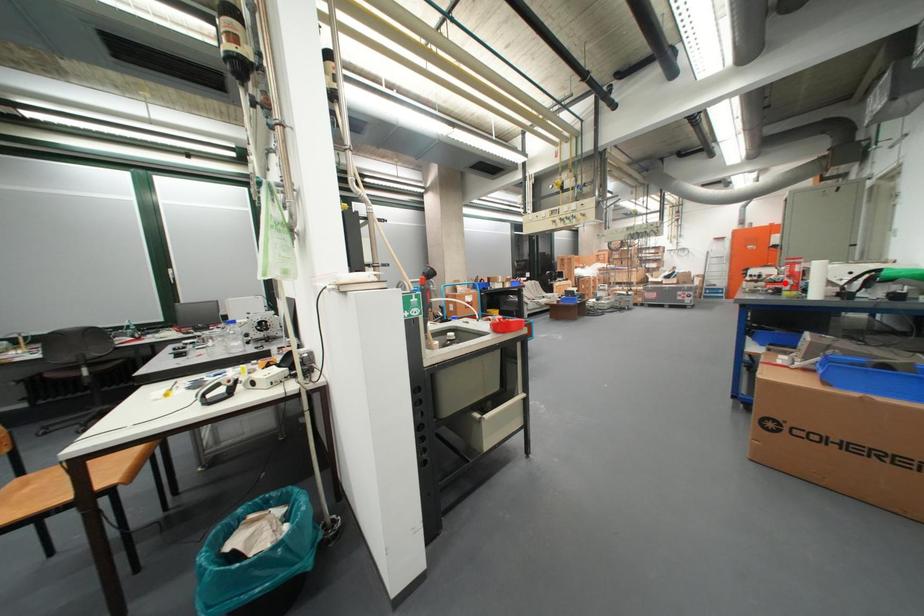
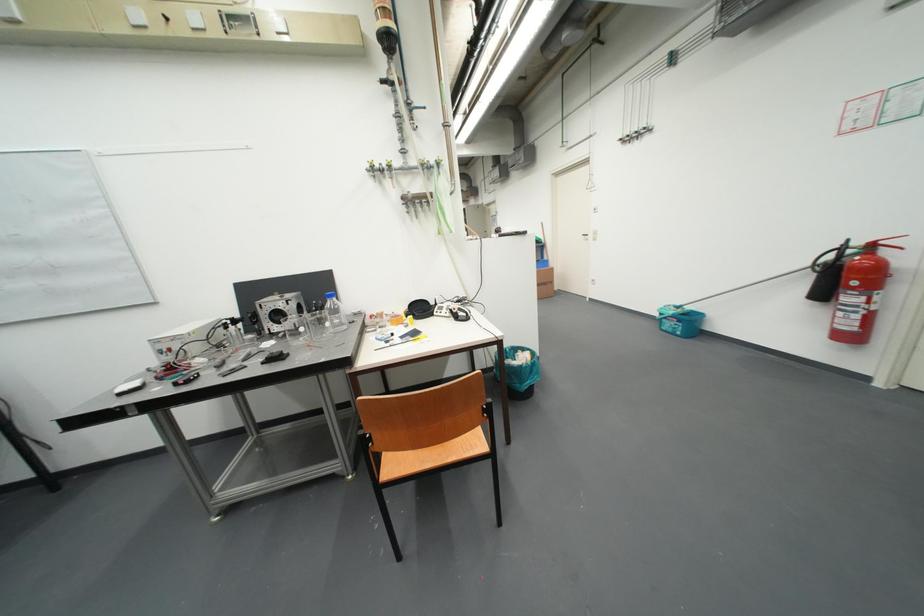
Question: I am providing you with two images of the same scene from different viewpoints. A red point is marked on the first image. Is the red point's position out of view in image 2?

Choices:
 (A) Yes
 (B) No

Answer: (A)